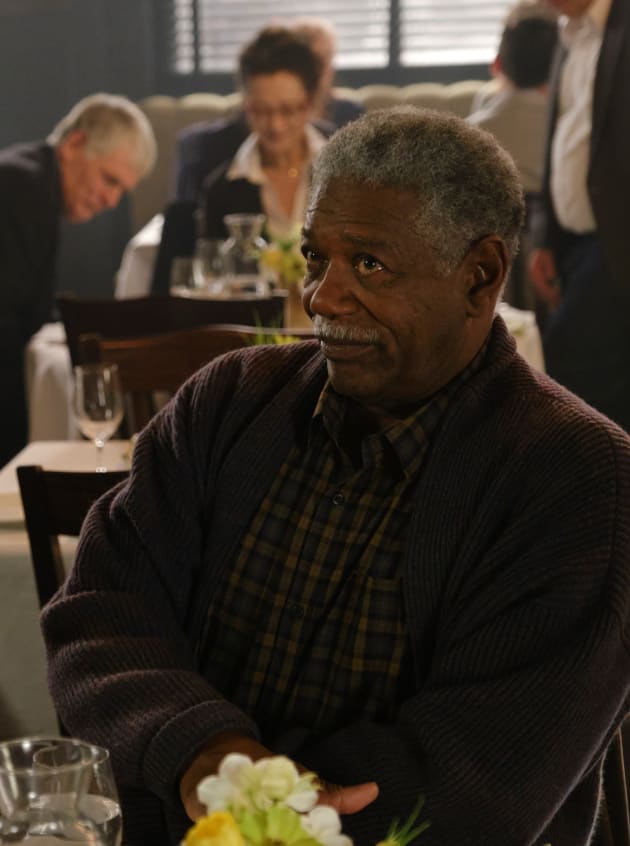
Find the location of `black outline of window`. black outline of window is located at coordinates coord(191,80).